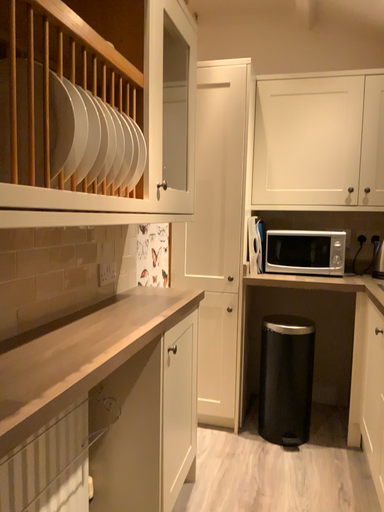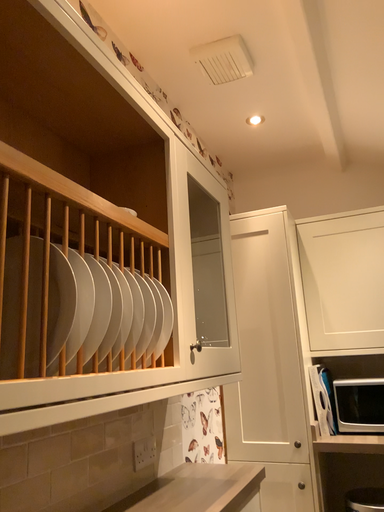
Question: Which way did the camera rotate in the video?

Choices:
 (A) rotated downward
 (B) rotated upward

Answer: (B)